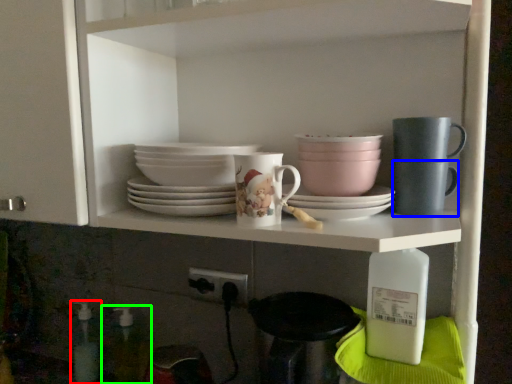
Question: Estimate the real-world distances between objects in this image. Which object is closer to bottle (highlighted by a red box), mug (highlighted by a blue box) or bottle (highlighted by a green box)?

Choices:
 (A) mug
 (B) bottle

Answer: (B)